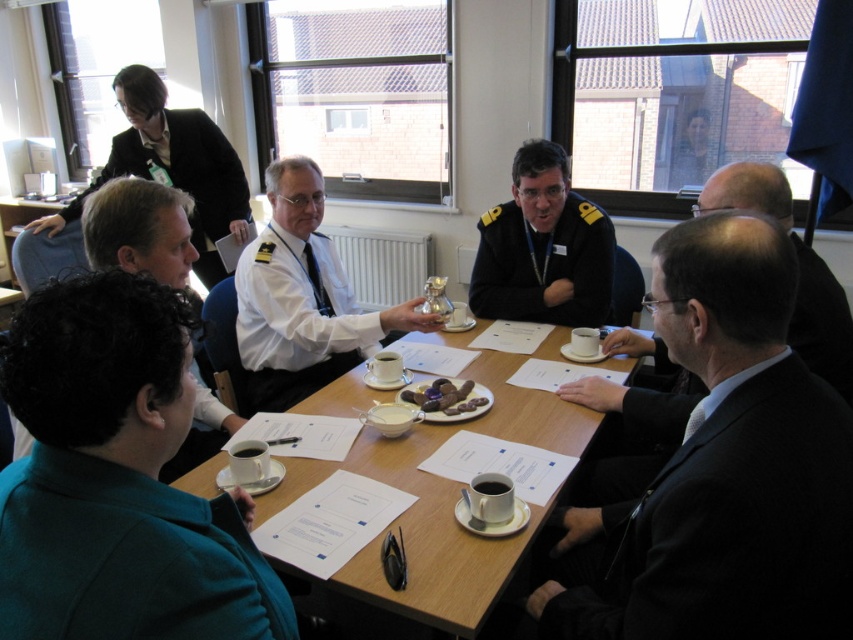
Question: Which of these objects is positioned farthest from the dark suit at center?

Choices:
 (A) wooden table at center
 (B) dark blue uniform at center
 (C) black uniform at upper left
 (D) silver metallic trophy at center

Answer: (C)

Question: Is dark suit at center positioned at the back of white uniform at upper center?

Choices:
 (A) no
 (B) yes

Answer: (A)

Question: Which point is closer to the camera?

Choices:
 (A) dark suit at center
 (B) silver metallic trophy at center
 (C) black uniform at upper left

Answer: (A)

Question: Is dark blue uniform at center wider than chocolate cake at center?

Choices:
 (A) yes
 (B) no

Answer: (A)

Question: Can you confirm if silver metallic trophy at center is positioned to the right of dark blue uniform at center?

Choices:
 (A) no
 (B) yes

Answer: (A)

Question: Which object appears farthest from the camera in this image?

Choices:
 (A) silver metallic trophy at center
 (B) chocolate cake at center
 (C) black uniform at upper left
 (D) dark suit at center

Answer: (C)